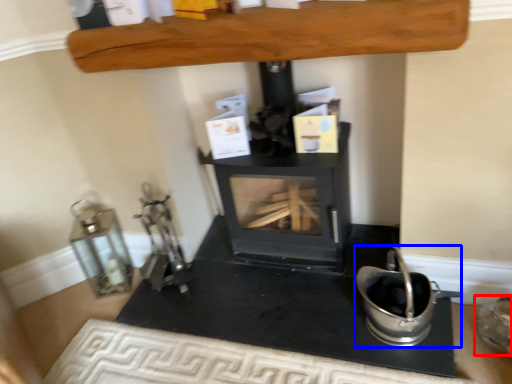
Question: Which of the following is the closest to the observer, appliance (highlighted by a red box) or appliance (highlighted by a blue box)?

Choices:
 (A) appliance
 (B) appliance

Answer: (B)